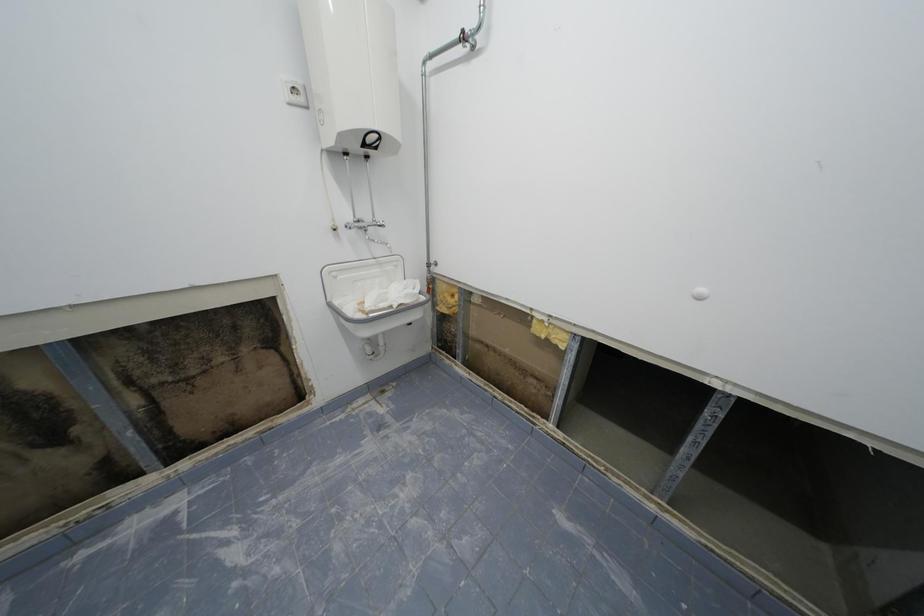
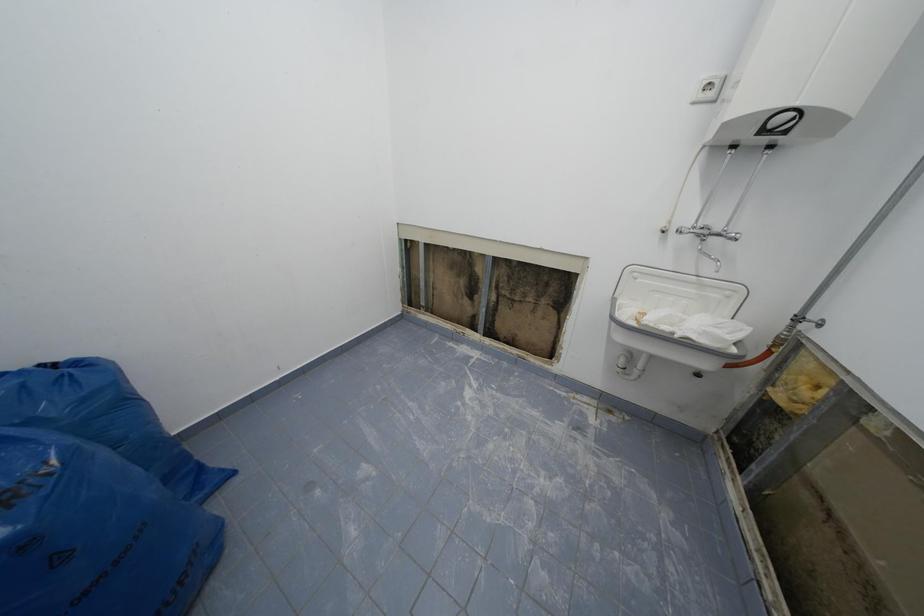
The first image is from the beginning of the video and the second image is from the end. How did the camera likely rotate when shooting the video?

The camera's rotation is toward left-down.